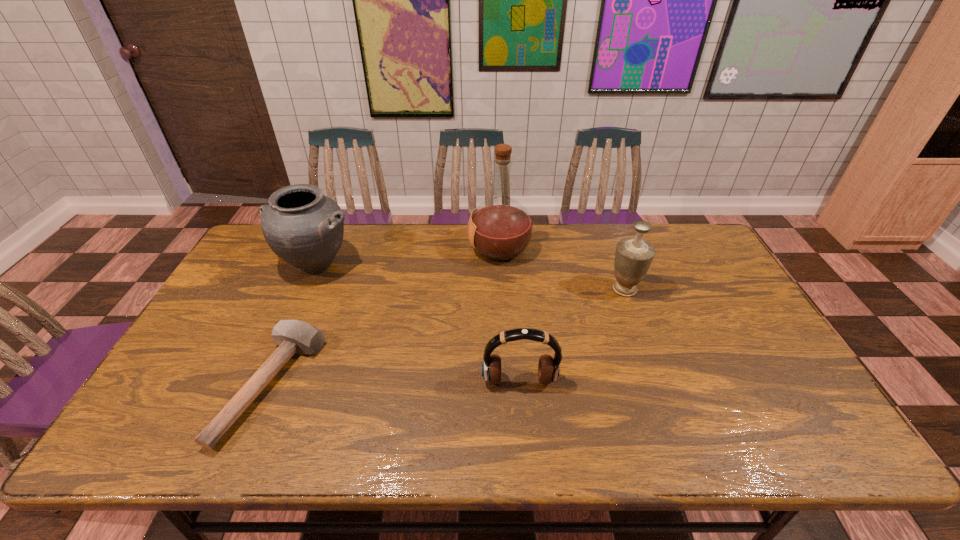
Identify the location of liquor. This screenshot has width=960, height=540. (500, 228).

Where is `the left urn`? the left urn is located at coordinates (305, 228).

The height and width of the screenshot is (540, 960). I want to click on the right urn, so click(633, 256).

Where is `the second shortest object`? The width and height of the screenshot is (960, 540). the second shortest object is located at coordinates (548, 368).

Find the location of `mallet`. mallet is located at coordinates (294, 336).

Identify the location of vacant space located on the front label of the liquor. (433, 249).

This screenshot has width=960, height=540. I want to click on free location located 0.060m on the front label of the liquor, so click(450, 249).

Locate an element on the screen. This screenshot has width=960, height=540. vacant region located on the front label of the liquor is located at coordinates (416, 249).

Image resolution: width=960 pixels, height=540 pixels. In order to click on vacant space situated 0.060m on the left of the left urn in this screenshot , I will do `click(258, 265)`.

Where is `free space located on the back of the rightmost object`? The height and width of the screenshot is (540, 960). free space located on the back of the rightmost object is located at coordinates (615, 264).